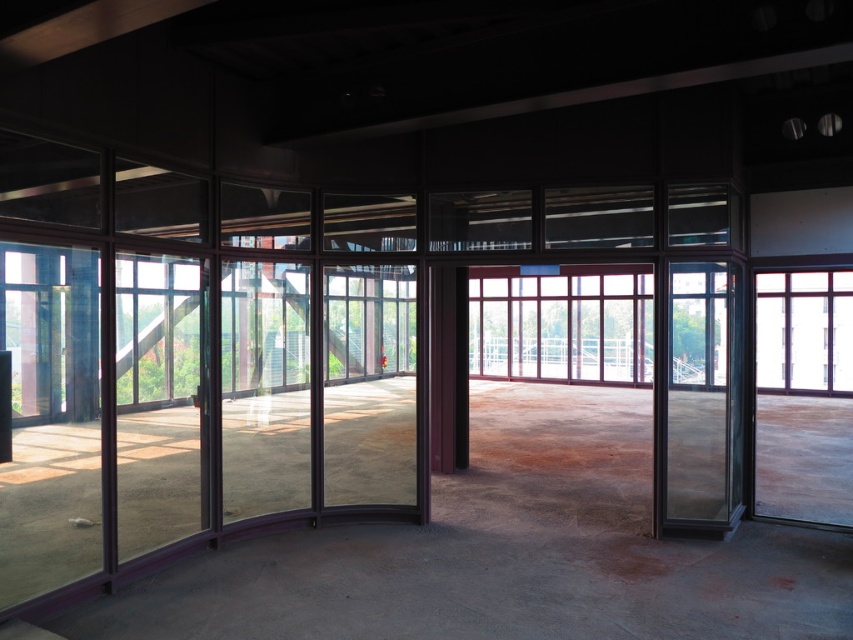
Consider the image. Between clear glass window at center and clear glass window at right, which one appears on the left side from the viewer's perspective?

clear glass window at center

Measure the distance between point (x=639, y=300) and camera.

Point (x=639, y=300) is 63.11 feet from camera.

The width and height of the screenshot is (853, 640). What are the coordinates of `clear glass window at center` in the screenshot? It's located at 561,323.

Who is lower down, transparent glass door at right or clear glass window at center?

transparent glass door at right

Does transparent glass door at right have a lesser height compared to clear glass window at center?

No.

Who is more distant from viewer, (680, 289) or (485, 364)?

The point (485, 364) is behind.

Identify the location of transparent glass door at right. Image resolution: width=853 pixels, height=640 pixels. (701, 396).

Does transparent glass door at right have a smaller size compared to clear glass window at right?

Yes.

Is transparent glass door at right taller than clear glass window at right?

Incorrect, transparent glass door at right's height is not larger of clear glass window at right's.

Describe the element at coordinates (701, 396) in the screenshot. This screenshot has height=640, width=853. I see `transparent glass door at right` at that location.

In order to click on transparent glass door at right in this screenshot , I will do `click(701, 396)`.